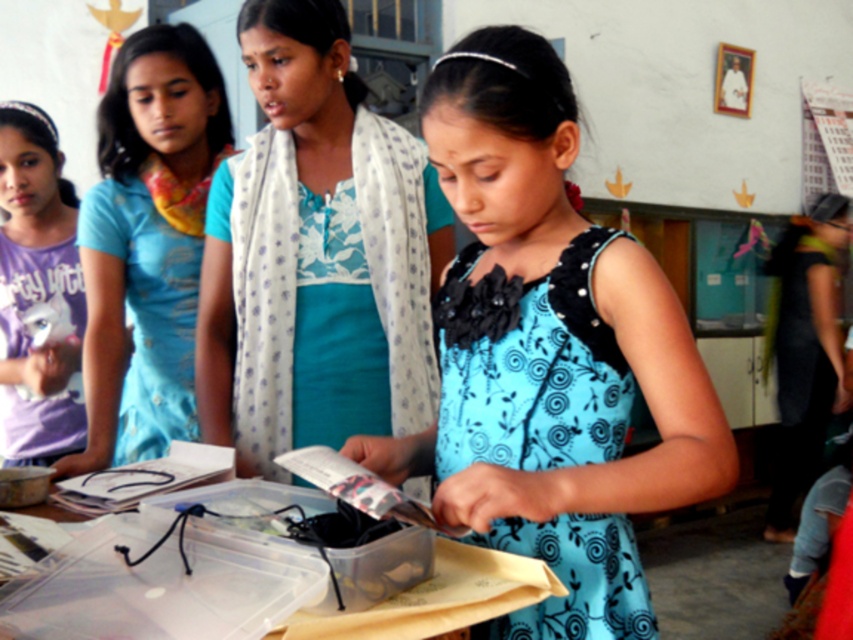
You are a photographer positioned at the entrance of the room. You need to capture a photo that includes both the blue printed dress at center and the matte blue dress at left. The camera you are using has a maximum focal length that allows capturing objects within a 30 inch distance. Will you be able to include both subjects in the photo?

The distance between the blue printed dress at center and the matte blue dress at left is 35.37 inches, which exceeds the camera maximum focal length of 30 inches. Therefore, you cannot include both subjects in the photo.